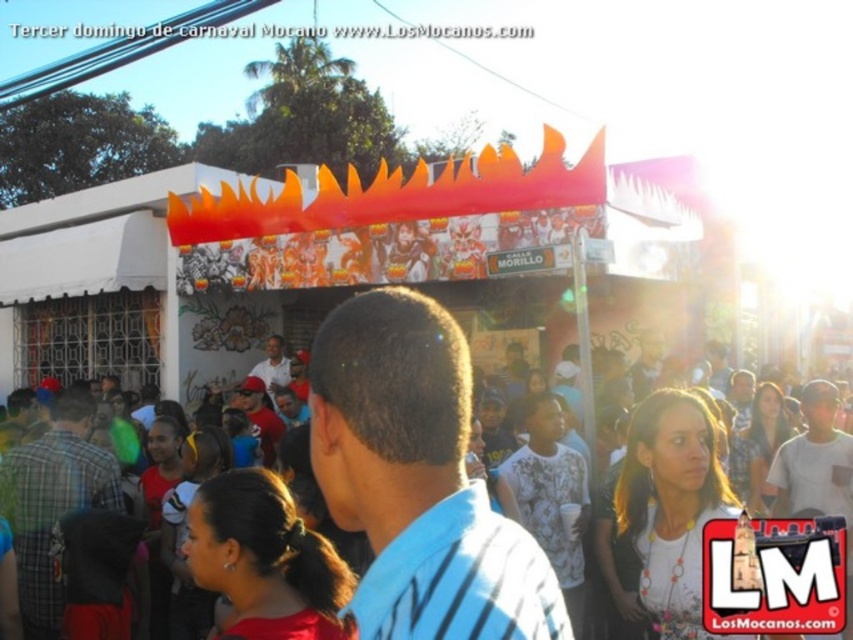
Where is `matte black crowd at center`? The width and height of the screenshot is (853, 640). matte black crowd at center is located at coordinates (416, 480).

Who is more forward, (438, 579) or (271, 385)?

Point (438, 579) is in front.

What are the coordinates of `matte black crowd at center` in the screenshot? It's located at (416, 480).

Image resolution: width=853 pixels, height=640 pixels. Describe the element at coordinates (416, 480) in the screenshot. I see `matte black crowd at center` at that location.

Who is higher up, matte black crowd at center or plaid fabric shirt at lower left?

Positioned higher is matte black crowd at center.

Which is behind, point (321, 460) or point (45, 548)?

Positioned behind is point (45, 548).

Locate an element on the screen. Image resolution: width=853 pixels, height=640 pixels. matte black crowd at center is located at coordinates (416, 480).

Who is lower down, blue striped shirt at center or plaid fabric shirt at lower left?

Positioned lower is plaid fabric shirt at lower left.

Which is more to the left, blue striped shirt at center or plaid fabric shirt at lower left?

From the viewer's perspective, plaid fabric shirt at lower left appears more on the left side.

Is point (525, 589) positioned behind point (74, 442)?

No, (525, 589) is closer to viewer.

The height and width of the screenshot is (640, 853). What are the coordinates of `blue striped shirt at center` in the screenshot? It's located at (418, 480).